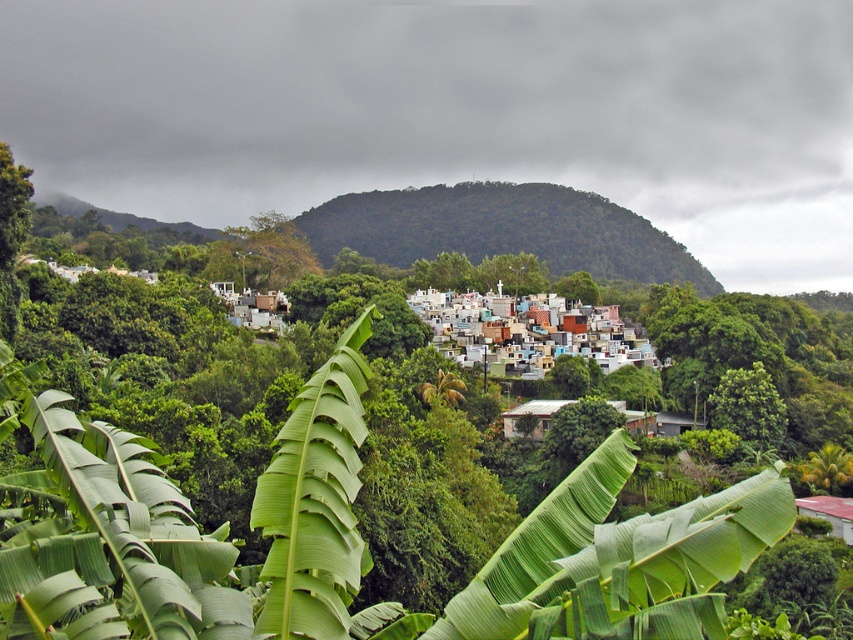
Is green leafy banana tree at center thinner than dark green forested hillside at center?

Yes, green leafy banana tree at center is thinner than dark green forested hillside at center.

Does green leafy banana tree at center appear on the left side of dark green forested hillside at center?

Correct, you'll find green leafy banana tree at center to the left of dark green forested hillside at center.

Does point (152, 570) come in front of point (376, 244)?

Yes, point (152, 570) is closer to viewer.

Find the location of a particular element. The height and width of the screenshot is (640, 853). green leafy banana tree at center is located at coordinates (340, 538).

Who is lower down, dark green forested hillside at center or multicolored painted houses at center?

Positioned lower is multicolored painted houses at center.

The image size is (853, 640). I want to click on dark green forested hillside at center, so click(x=503, y=230).

Is point (514, 228) closer to camera compared to point (537, 298)?

No, (514, 228) is behind (537, 298).

Identify the location of dark green forested hillside at center. This screenshot has height=640, width=853. (503, 230).

What do you see at coordinates (340, 538) in the screenshot?
I see `green leafy banana tree at center` at bounding box center [340, 538].

Who is shorter, green leafy banana tree at center or multicolored painted houses at center?

Standing shorter between the two is multicolored painted houses at center.

Who is more distant from viewer, (107, 454) or (622, 342)?

The point (622, 342) is behind.

This screenshot has width=853, height=640. In order to click on green leafy banana tree at center in this screenshot , I will do `click(340, 538)`.